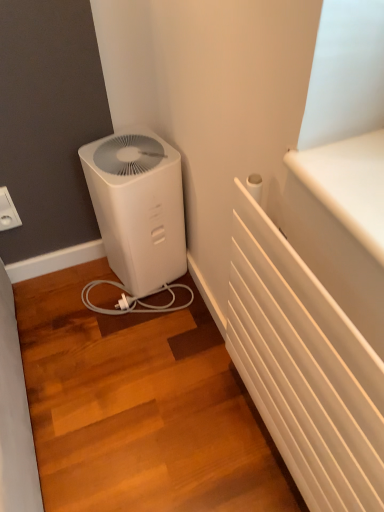
The width and height of the screenshot is (384, 512). I want to click on vacant space positioned to the left of white plastic air purifier at lower left, so click(85, 291).